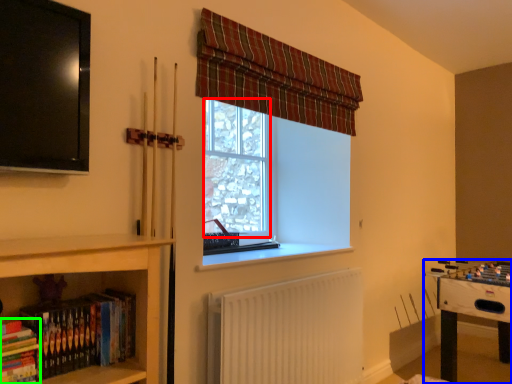
Question: Which object is the farthest from bay window (highlighted by a red box)? Choose among these: table (highlighted by a blue box) or book (highlighted by a green box).

Choices:
 (A) table
 (B) book

Answer: (B)